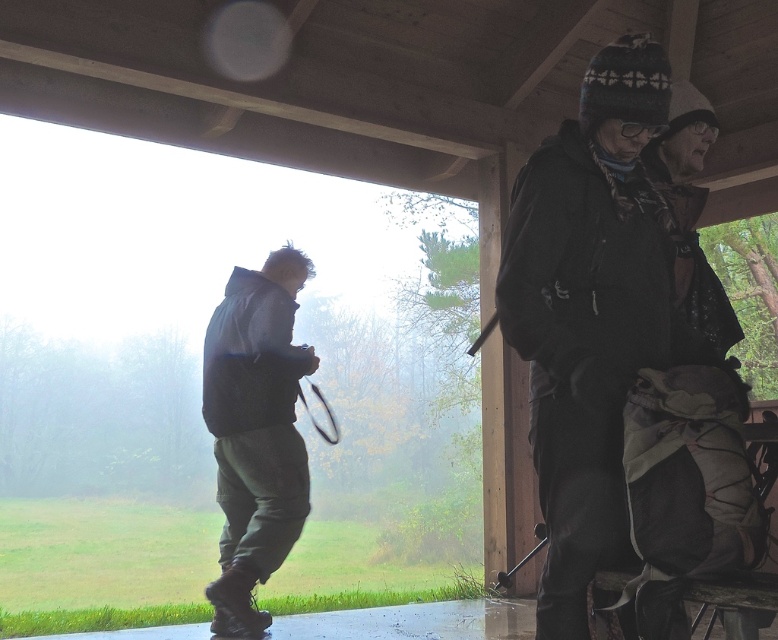
Is dark green pants at left thinner than black rubber tennis racket at lower left?

In fact, dark green pants at left might be wider than black rubber tennis racket at lower left.

Between dark green pants at left and black rubber tennis racket at lower left, which one appears on the left side from the viewer's perspective?

dark green pants at left is more to the left.

Between point (286, 449) and point (331, 412), which one is positioned in front?

Point (286, 449) is in front.

This screenshot has width=778, height=640. In order to click on dark green pants at left in this screenshot , I will do `click(254, 432)`.

Between dark gray knit hat at upper right and black rubber tennis racket at lower left, which one appears on the left side from the viewer's perspective?

black rubber tennis racket at lower left

Is dark gray knit hat at upper right wider than black rubber tennis racket at lower left?

Indeed, dark gray knit hat at upper right has a greater width compared to black rubber tennis racket at lower left.

Based on the photo, measure the distance between dark gray knit hat at upper right and camera.

1.91 meters

At what (x,y) coordinates should I click in order to perform the action: click on dark gray knit hat at upper right. Please return your answer as a coordinate pair (x, y). Image resolution: width=778 pixels, height=640 pixels. Looking at the image, I should click on (587, 312).

Between dark gray knit hat at upper right and dark green pants at left, which one is positioned lower?

dark green pants at left

Does dark gray knit hat at upper right appear on the right side of dark green pants at left?

Yes, dark gray knit hat at upper right is to the right of dark green pants at left.

The height and width of the screenshot is (640, 778). Describe the element at coordinates (587, 312) in the screenshot. I see `dark gray knit hat at upper right` at that location.

Where is `dark gray knit hat at upper right`? This screenshot has width=778, height=640. dark gray knit hat at upper right is located at coordinates (587, 312).